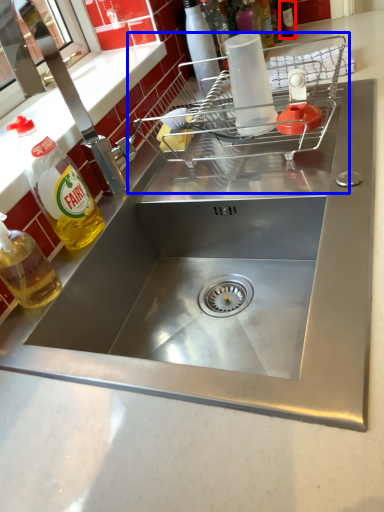
Question: Which object is closer to the camera taking this photo, bottle (highlighted by a red box) or appliance (highlighted by a blue box)?

Choices:
 (A) bottle
 (B) appliance

Answer: (B)